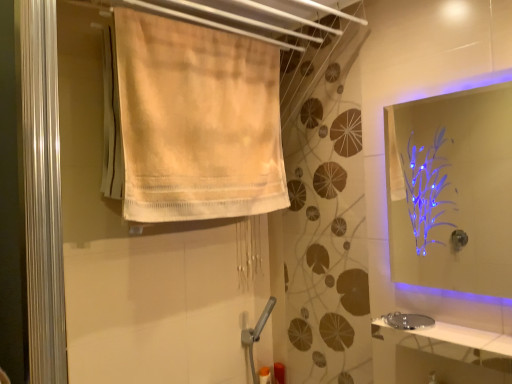
Question: Is beige cotton towel at upper left closer to the viewer compared to transparent acrylic mirror at upper right?

Choices:
 (A) no
 (B) yes

Answer: (A)

Question: Considering the relative sizes of beige cotton towel at upper left and transparent acrylic mirror at upper right in the image provided, is beige cotton towel at upper left smaller than transparent acrylic mirror at upper right?

Choices:
 (A) no
 (B) yes

Answer: (A)

Question: Is beige cotton towel at upper left oriented away from transparent acrylic mirror at upper right?

Choices:
 (A) yes
 (B) no

Answer: (B)

Question: Does beige cotton towel at upper left appear on the right side of transparent acrylic mirror at upper right?

Choices:
 (A) yes
 (B) no

Answer: (B)

Question: Is beige cotton towel at upper left in contact with transparent acrylic mirror at upper right?

Choices:
 (A) no
 (B) yes

Answer: (A)

Question: From a real-world perspective, is beige cotton towel at upper left located higher than transparent acrylic mirror at upper right?

Choices:
 (A) yes
 (B) no

Answer: (A)

Question: Is white glossy counter top at lower right thinner than silver metallic sink at lower right?

Choices:
 (A) no
 (B) yes

Answer: (A)

Question: Is white glossy counter top at lower right directly adjacent to silver metallic sink at lower right?

Choices:
 (A) yes
 (B) no

Answer: (B)

Question: Is white glossy counter top at lower right positioned beyond the bounds of silver metallic sink at lower right?

Choices:
 (A) no
 (B) yes

Answer: (B)

Question: Can you confirm if white glossy counter top at lower right is taller than silver metallic sink at lower right?

Choices:
 (A) yes
 (B) no

Answer: (A)

Question: Considering the relative sizes of white glossy counter top at lower right and silver metallic sink at lower right in the image provided, is white glossy counter top at lower right smaller than silver metallic sink at lower right?

Choices:
 (A) yes
 (B) no

Answer: (B)

Question: From a real-world perspective, is white glossy counter top at lower right positioned under silver metallic sink at lower right based on gravity?

Choices:
 (A) yes
 (B) no

Answer: (A)

Question: Does transparent acrylic mirror at upper right have a lesser height compared to translucent plastic bottle at lower center?

Choices:
 (A) yes
 (B) no

Answer: (B)